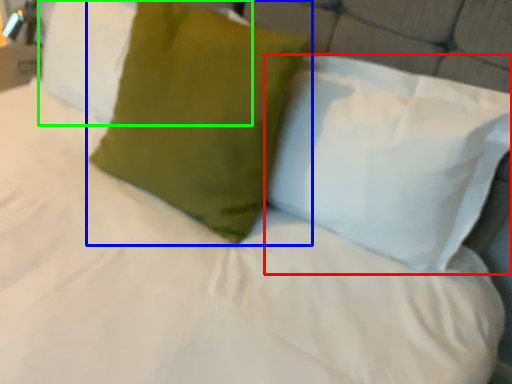
Question: Considering the real-world distances, which object is farthest from pillow (highlighted by a red box)? pillow (highlighted by a blue box) or pillow (highlighted by a green box)?

Choices:
 (A) pillow
 (B) pillow

Answer: (B)